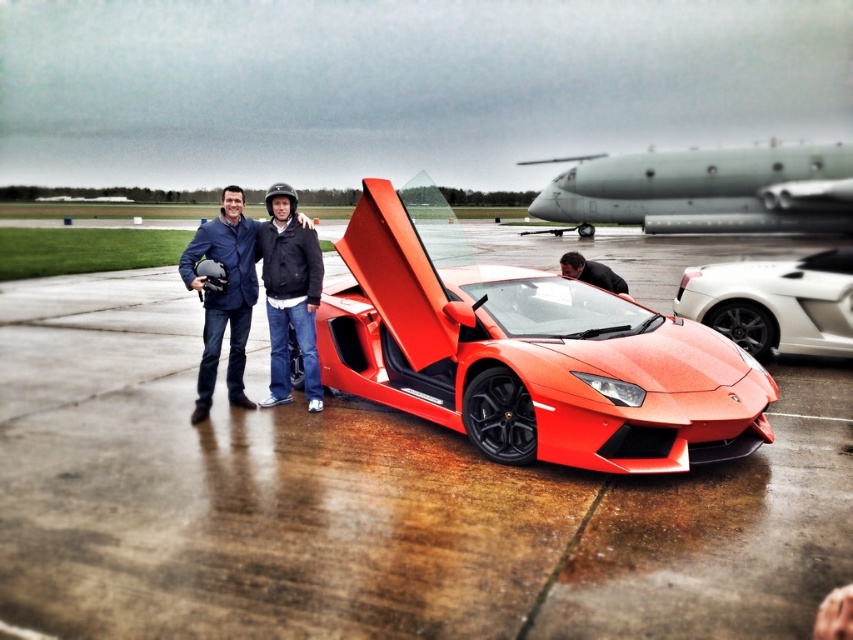
You are a photographer trying to capture the glossy concrete tarmac at center and the matte black jacket at center in a single frame. Which object should you focus on first if you want to ensure both are in focus without adjusting your camera settings?

You should focus on the matte black jacket at center first because it is smaller than the glossy concrete tarmac at center, so focusing on the smaller object increases the chance of both being in focus.